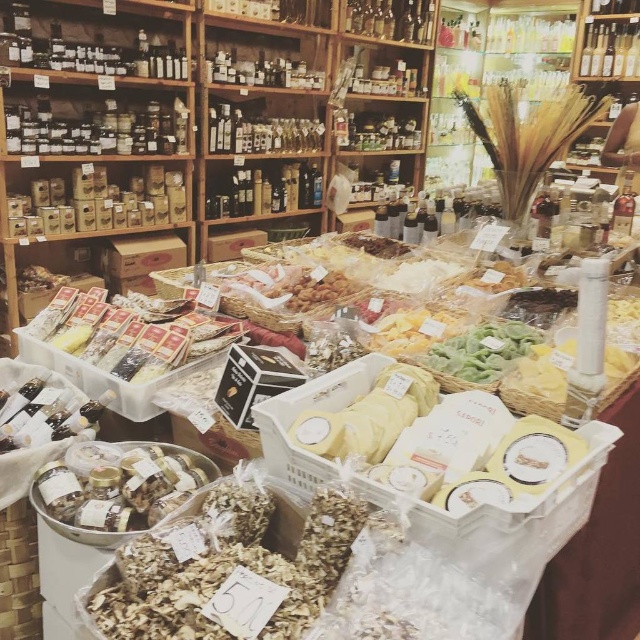
Question: Based on their relative distances, which object is nearer to the brown crumbly at center?

Choices:
 (A) translucent plastic jars at center
 (B) green leafy vegetables at center

Answer: (A)

Question: Can you confirm if translucent plastic jars at center is positioned to the right of green leafy vegetables at center?

Choices:
 (A) yes
 (B) no

Answer: (B)

Question: Which of the following is the farthest from the observer?

Choices:
 (A) (449, 371)
 (B) (260, 499)
 (C) (147, 442)

Answer: (C)

Question: Is brown crumbly at center above translucent plastic jars at center?

Choices:
 (A) yes
 (B) no

Answer: (B)

Question: Does translucent plastic jars at center have a larger size compared to green leafy vegetables at center?

Choices:
 (A) yes
 (B) no

Answer: (A)

Question: Considering the real-world distances, which object is farthest from the brown crumbly at center?

Choices:
 (A) green leafy vegetables at center
 (B) translucent plastic jars at center

Answer: (A)